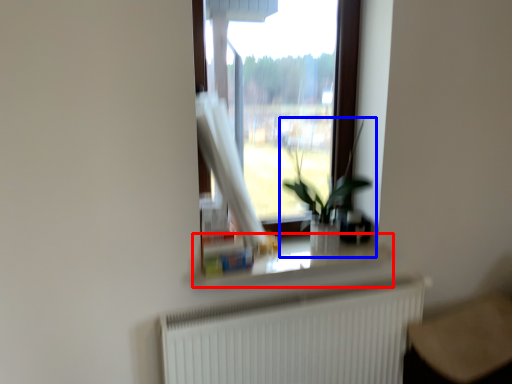
Question: Among these objects, which one is nearest to the camera, window sill (highlighted by a red box) or houseplant (highlighted by a blue box)?

Choices:
 (A) window sill
 (B) houseplant

Answer: (B)